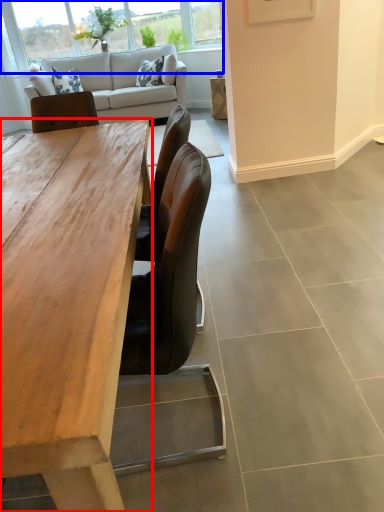
Question: Among these objects, which one is farthest to the camera, desk (highlighted by a red box) or window (highlighted by a blue box)?

Choices:
 (A) desk
 (B) window

Answer: (B)